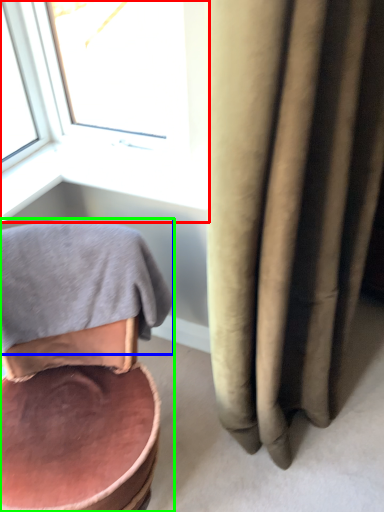
Question: Which object is positioned farthest from window (highlighted by a red box)? Select from bath towel (highlighted by a blue box) and chair (highlighted by a green box).

Choices:
 (A) bath towel
 (B) chair

Answer: (B)